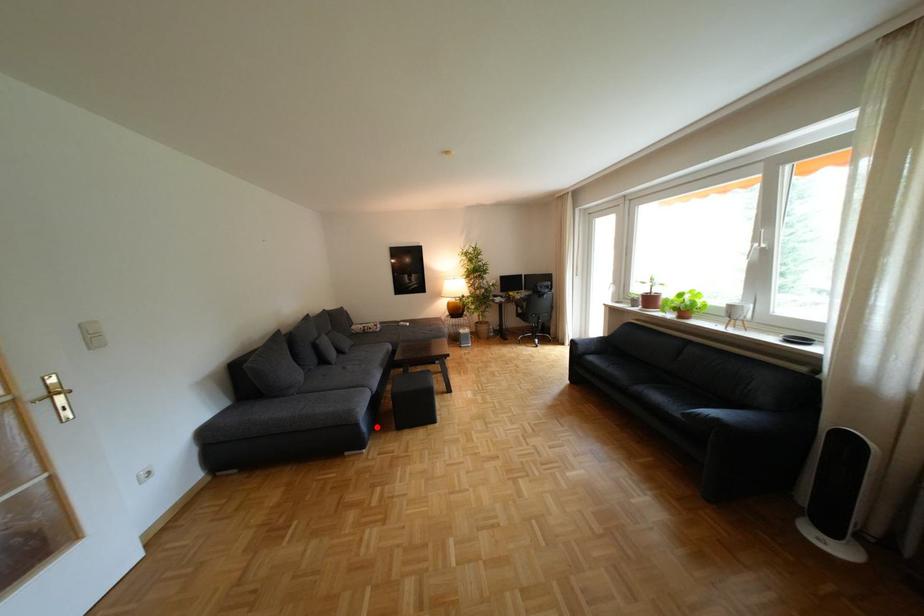
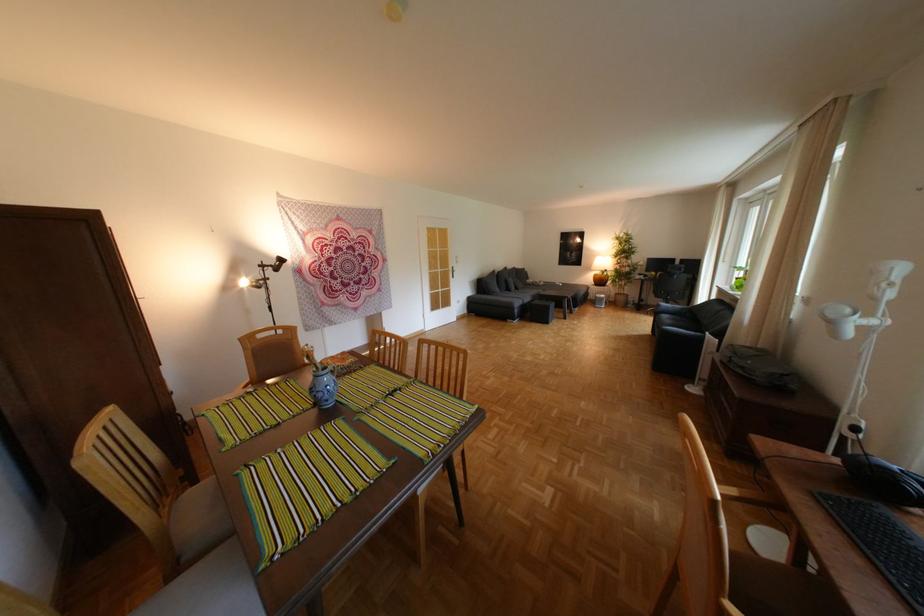
Question: A red point is marked in image1. In image2, is the corresponding 3D point closer to the camera or farther? Reply with the corresponding letter.

Choices:
 (A) The corresponding 3D point is closer.
 (B) The corresponding 3D point is farther.

Answer: (B)